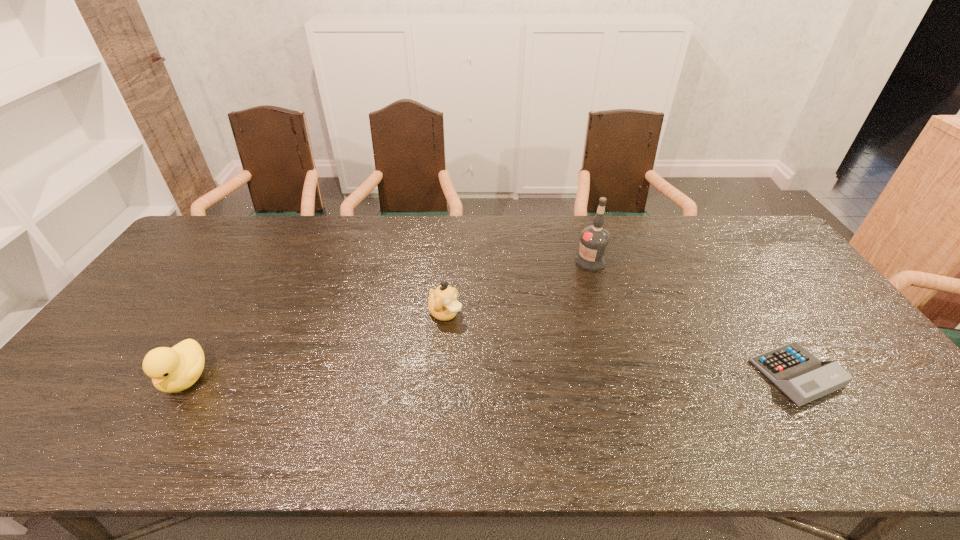
Image resolution: width=960 pixels, height=540 pixels. Identify the location of free space located 0.350m on the face of the duckling. (559, 397).

At what (x,y) coordinates should I click in order to perform the action: click on free space located 0.170m on the front label of the vodka. Please return your answer as a coordinate pair (x, y). The height and width of the screenshot is (540, 960). Looking at the image, I should click on (572, 305).

In order to click on blank area located on the front label of the vodka in this screenshot , I will do `click(551, 357)`.

Identify the location of free region located 0.090m on the front label of the vodka. (580, 288).

Identify the location of object located in the far edge section of the desktop. (594, 240).

Image resolution: width=960 pixels, height=540 pixels. Identify the location of duck that is at the near edge. (175, 369).

Identify the location of calculator present at the near edge. (801, 376).

Find the location of a particular element. object present at the right edge is located at coordinates (801, 376).

The image size is (960, 540). What are the coordinates of `object located in the near right corner section of the desktop` in the screenshot? It's located at (801, 376).

In order to click on vacant space at the far edge of the desktop in this screenshot , I will do `click(378, 215)`.